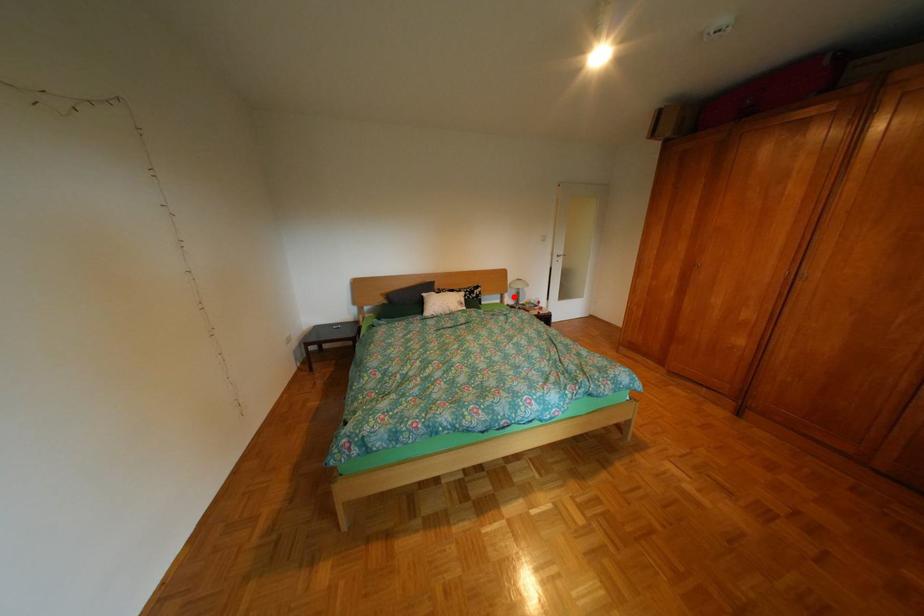
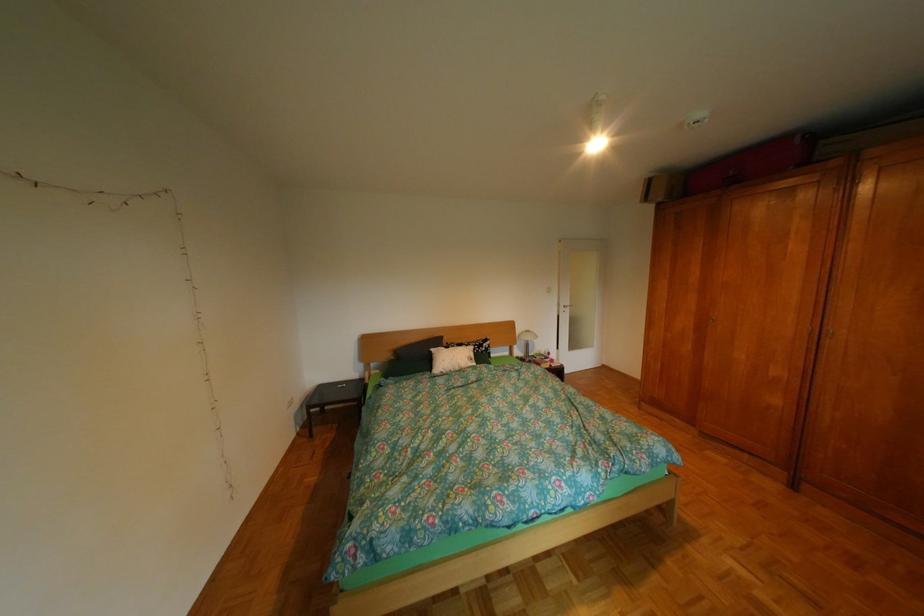
In the second image, find the point that corresponds to the highlighted location in the first image.

(523, 349)